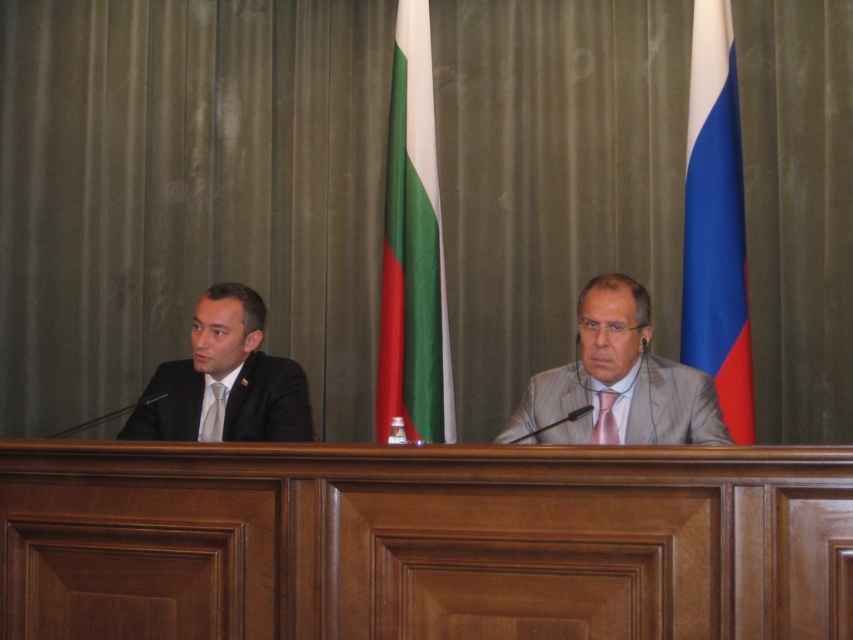
You are a photographer setting up for a formal event. You need to ensure that all items at the center of the frame are of similar height for aesthetic balance. Given the green fabric flag at center and the pink satin tie at center, which item should you adjust to achieve this balance?

The green fabric flag at center is taller than the pink satin tie at center. To achieve balance, you should lower the green fabric flag at center or raise the pink satin tie at center so both items reach a similar height.

You are attending a virtual meeting and want to focus on the green fabric flag at center and the pink satin tie at center. Which object is closer to you in the image?

The green fabric flag at center is closer to you than the pink satin tie at center because it is further to the viewer.

You are a photographer positioned behind the wooden table where the two individuals are seated. You need to capture a photo that includes both the blue fabric flag at right and the matte black tie at left. Given that your camera has a maximum focus range of 1.6 meters, will you be able to focus on both subjects simultaneously?

The blue fabric flag at right is 1.58 meters away from the matte black tie at left. Since the distance between them is within the camera maximum focus range of 1.6 meters, you can focus on both subjects simultaneously.